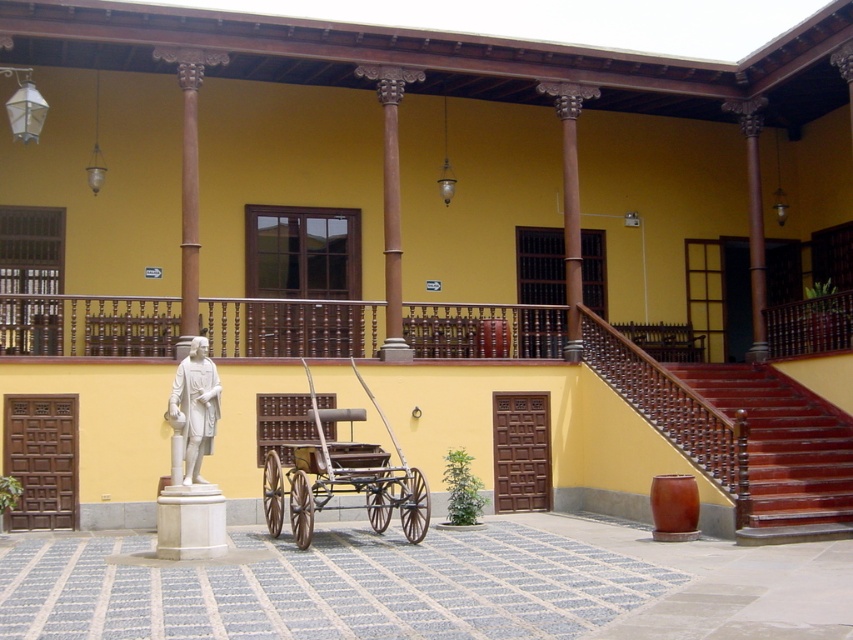
You are a tour guide leading a group in the courtyard. You need to move a decorative pot from the shiny red wood stairs at right to the white marble statue at center. Which object has a wider base to place the pot more securely?

The shiny red wood stairs at right has a larger width than the white marble statue at center, so placing the pot on the shiny red wood stairs at right would provide a more stable base.

You are a tour guide leading visitors through the courtyard. You want to point out the white marble statue at center and the rustic wood cart at center. Which one is positioned to the right side of the other?

The rustic wood cart at center is positioned to the right of the white marble statue at center.